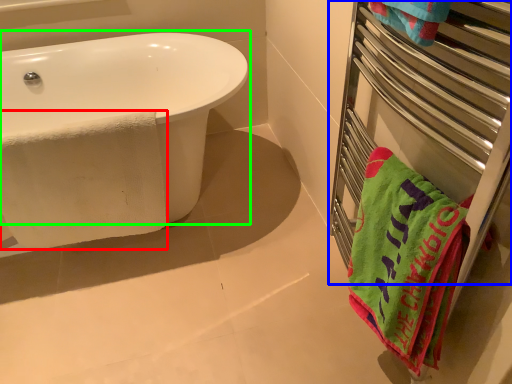
Question: Which object is positioned closest to beach towel (highlighted by a red box)? Select from balustrade (highlighted by a blue box) and bathtub (highlighted by a green box).

Choices:
 (A) balustrade
 (B) bathtub

Answer: (B)